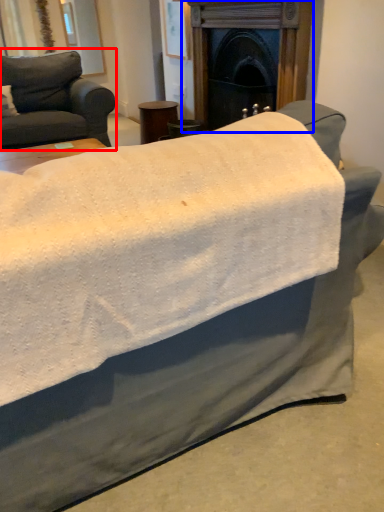
Question: Which point is closer to the camera, studio couch (highlighted by a red box) or fireplace (highlighted by a blue box)?

Choices:
 (A) studio couch
 (B) fireplace

Answer: (B)